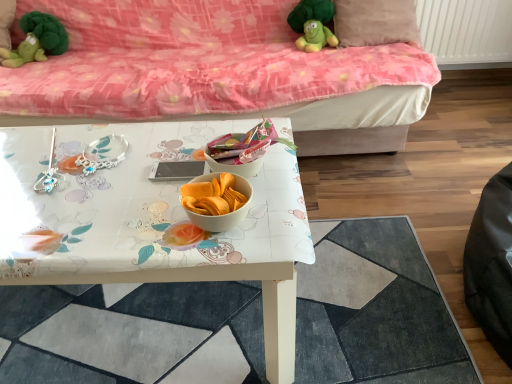
Locate an element on the screen. vacant space underneath white glossy table at center (from a real-world perspective) is located at coordinates (256, 310).